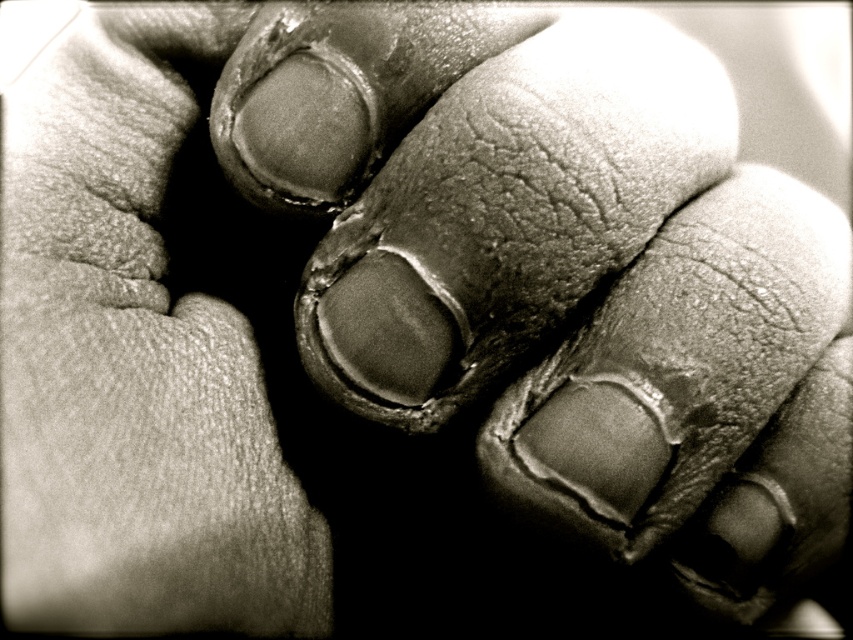
You are a tailor measuring materials for a custom leather glove. You have a smooth leather hand at center and a leather glove at left. Which material piece is shorter in length?

The smooth leather hand at center is shorter than the leather glove at left, so the smooth leather hand at center is the shorter piece.

You are a tailor measuring the distance between two items for a custom order. You have a smooth leather hand at center and a leather glove at left. Can you fit a 4.5 inch wide decorative ribbon between them?

The smooth leather hand at center is 4.60 inches from the leather glove at left. Since the distance between them is 4.60 inches and the ribbon is 4.5 inches wide, the ribbon can fit between them with a small gap remaining.